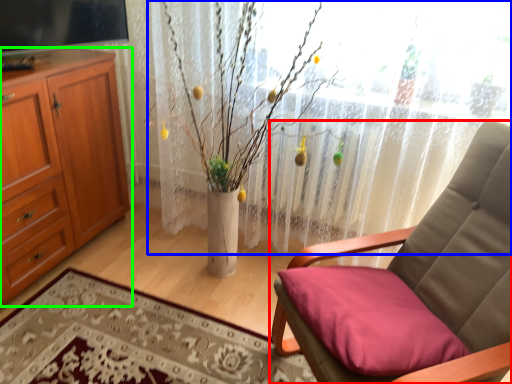
Question: Based on their relative distances, which object is farther from chair (highlighted by a red box)? Choose from curtain (highlighted by a blue box) and cabinetry (highlighted by a green box).

Choices:
 (A) curtain
 (B) cabinetry

Answer: (B)